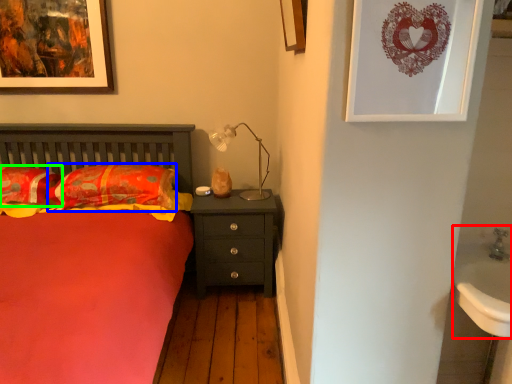
Question: Estimate the real-world distances between objects in this image. Which object is farther from sink (highlighted by a red box), pillow (highlighted by a blue box) or pillow (highlighted by a green box)?

Choices:
 (A) pillow
 (B) pillow

Answer: (B)